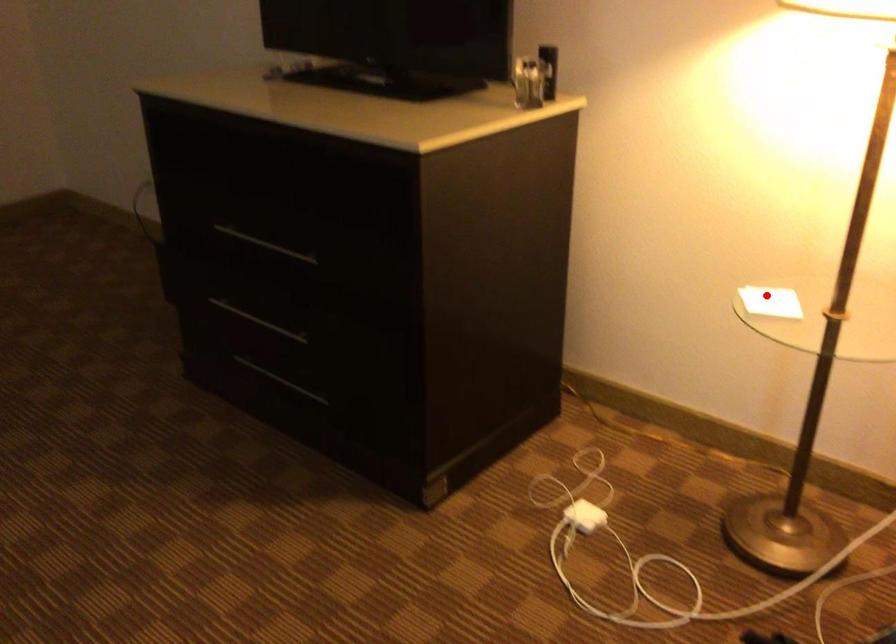
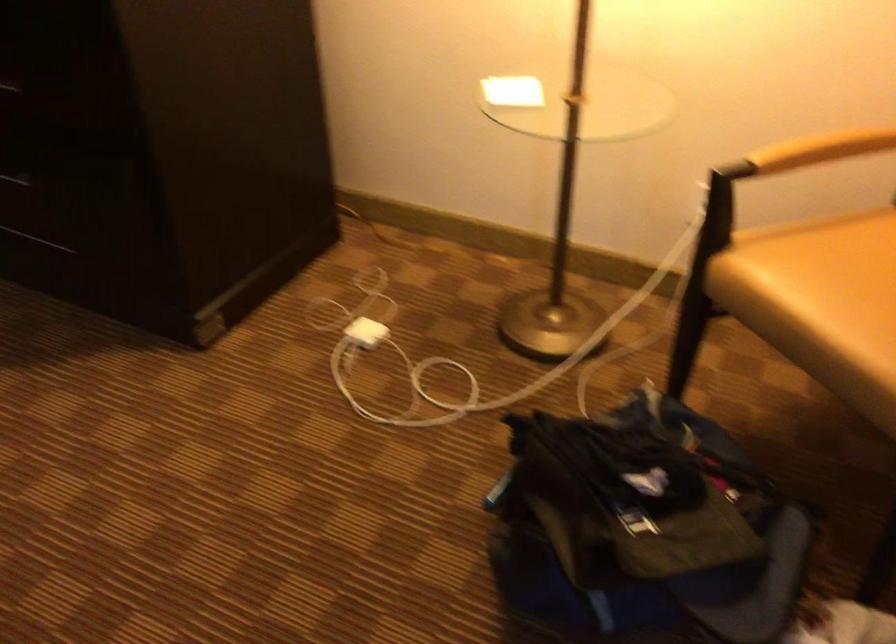
Question: I am providing you with two images of the same scene from different viewpoints. A red point is marked on the first image. At the location where the point appears in image 1, is it still visible in image 2?

Choices:
 (A) Yes
 (B) No

Answer: (A)